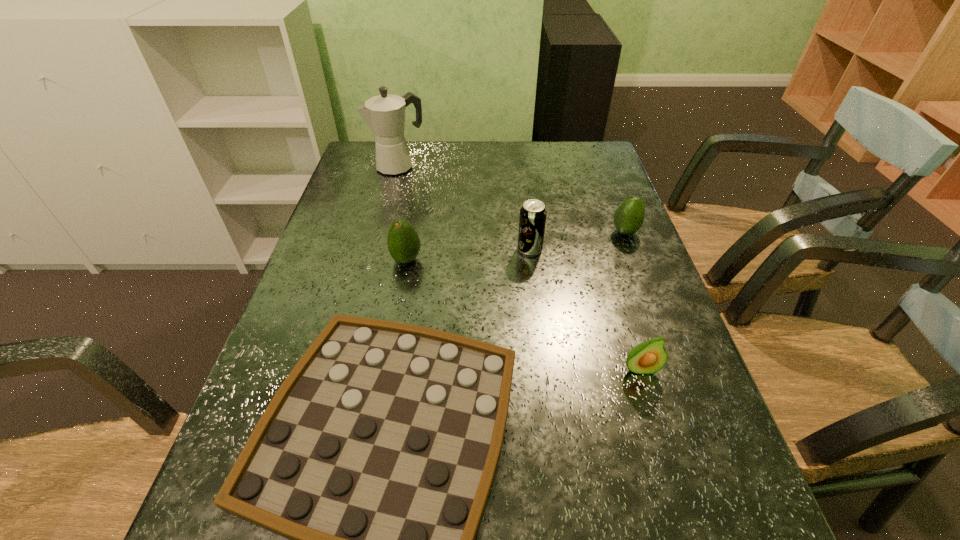
The width and height of the screenshot is (960, 540). I want to click on free space located 0.140m on the cut side of the nearest avocado, so click(x=665, y=450).

Find the location of a particular element. The height and width of the screenshot is (540, 960). object that is at the far edge is located at coordinates (385, 114).

Where is `object that is positioned at the left edge`? This screenshot has height=540, width=960. object that is positioned at the left edge is located at coordinates (385, 114).

You are a GUI agent. You are given a task and a screenshot of the screen. Output one action in this format:
    pyautogui.click(x=<x>, y=<y>)
    Task: Click on the object that is at the far left corner
    
    Given the screenshot: What is the action you would take?
    pyautogui.click(x=385, y=114)

In the image, there is a desktop. At what (x,y) coordinates should I click in order to perform the action: click on vacant space at the far edge. Please return your answer as a coordinate pair (x, y). Looking at the image, I should click on (421, 161).

Locate an element on the screen. The width and height of the screenshot is (960, 540). free space at the near edge of the desktop is located at coordinates (650, 537).

In the image, there is a desktop. Where is `vacant space at the left edge`? The height and width of the screenshot is (540, 960). vacant space at the left edge is located at coordinates (314, 269).

Image resolution: width=960 pixels, height=540 pixels. In the image, there is a desktop. In order to click on vacant space at the right edge in this screenshot , I will do `click(597, 254)`.

In the image, there is a desktop. At what (x,y) coordinates should I click in order to perform the action: click on vacant space at the far left corner. Please return your answer as a coordinate pair (x, y). Image resolution: width=960 pixels, height=540 pixels. Looking at the image, I should click on pyautogui.click(x=368, y=160).

The width and height of the screenshot is (960, 540). Identify the location of vacant space at the far right corner of the desktop. (589, 147).